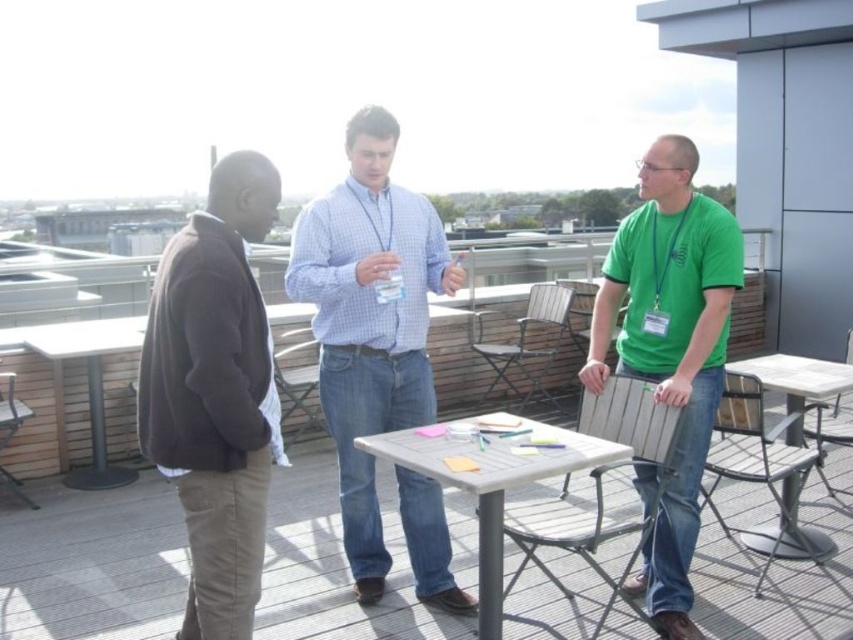
You are a photographer trying to capture a candid shot of the green cotton shirt at center and the white plastic table at right. Since you want to focus on both subjects, which one should you position closer to the camera to ensure they are both in sharp focus?

The green cotton shirt at center is in front of the white plastic table at right, so positioning the green cotton shirt at center closer to the camera will help keep both in focus as they are already aligned along the same depth plane.

You are a photographer standing at the edge of the rooftop, wanting to capture a candid shot of the dark brown sweater at left and the light blue checkered shirt in the middle. How far apart are these two individuals?

The dark brown sweater at left and the light blue checkered shirt in the middle are 1.96 meters apart.

You are standing at the point labeled point (724, 220). You want to walk to the table in the scene. How far will you have to walk?

You are currently at point (724, 220), which is 9.20 feet away from the table. Therefore, you will have to walk 9.20 feet to reach the table.